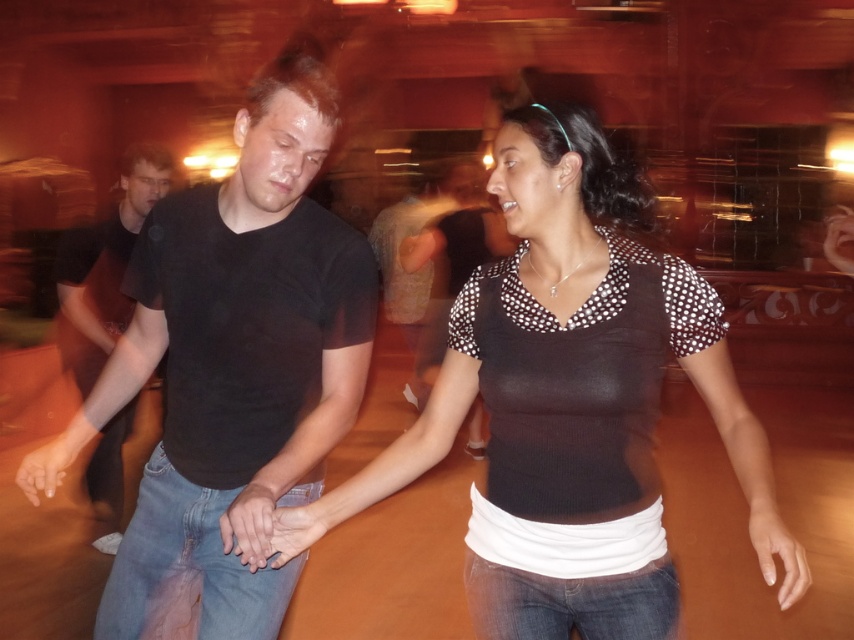
Question: Which object is farther from the camera taking this photo?

Choices:
 (A) black matte t-shirt at center
 (B) black cotton shirt at left

Answer: (B)

Question: Observing the image, what is the correct spatial positioning of black knitted top at center in reference to black cotton shirt at left?

Choices:
 (A) left
 (B) right

Answer: (B)

Question: Based on their relative distances, which object is nearer to the black knitted top at center?

Choices:
 (A) black cotton shirt at left
 (B) black matte t-shirt at center

Answer: (B)

Question: Is black matte t-shirt at center further to camera compared to black knitted top at center?

Choices:
 (A) yes
 (B) no

Answer: (A)

Question: Does black matte t-shirt at center have a lesser width compared to black knitted top at center?

Choices:
 (A) no
 (B) yes

Answer: (B)

Question: Based on their relative distances, which object is nearer to the black matte t-shirt at center?

Choices:
 (A) black cotton shirt at left
 (B) black knitted top at center

Answer: (B)